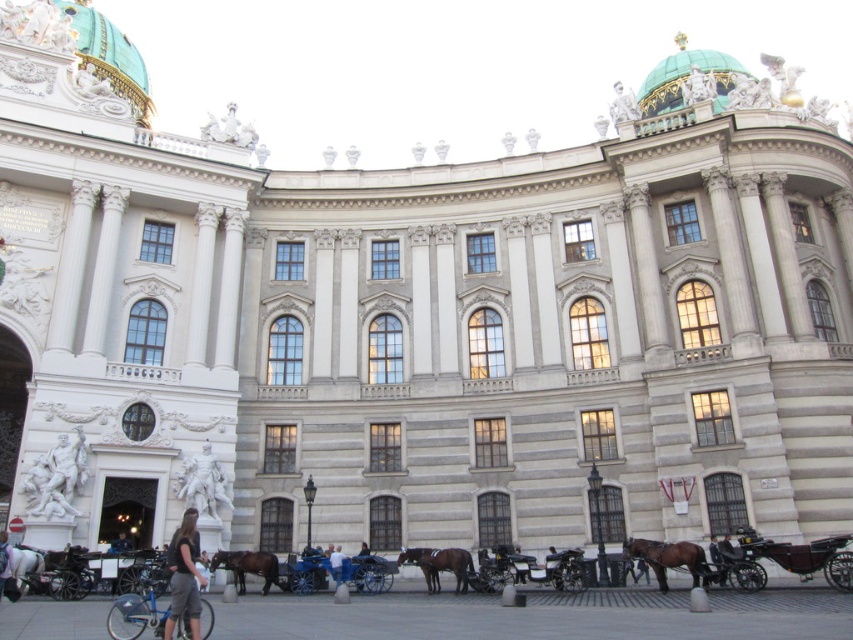
Question: Where is dark gray fabric pants at lower left located in relation to brown glossy horse at lower center in the image?

Choices:
 (A) below
 (B) above

Answer: (B)

Question: Based on their relative distances, which object is nearer to the brown glossy horse at center?

Choices:
 (A) brown glossy horse at lower center
 (B) brown glossy horse at lower right

Answer: (B)

Question: Is brown glossy horse at lower center closer to camera compared to dark blue jeans at lower left?

Choices:
 (A) no
 (B) yes

Answer: (B)

Question: Can you confirm if brown glossy horse at lower right is positioned to the left of brown glossy horse at lower center?

Choices:
 (A) no
 (B) yes

Answer: (A)

Question: Which point appears farthest from the camera in this image?

Choices:
 (A) (705, 566)
 (B) (109, 548)
 (C) (264, 570)

Answer: (B)

Question: Which point is farther to the camera?

Choices:
 (A) (196, 595)
 (B) (268, 577)
 (C) (630, 548)

Answer: (B)